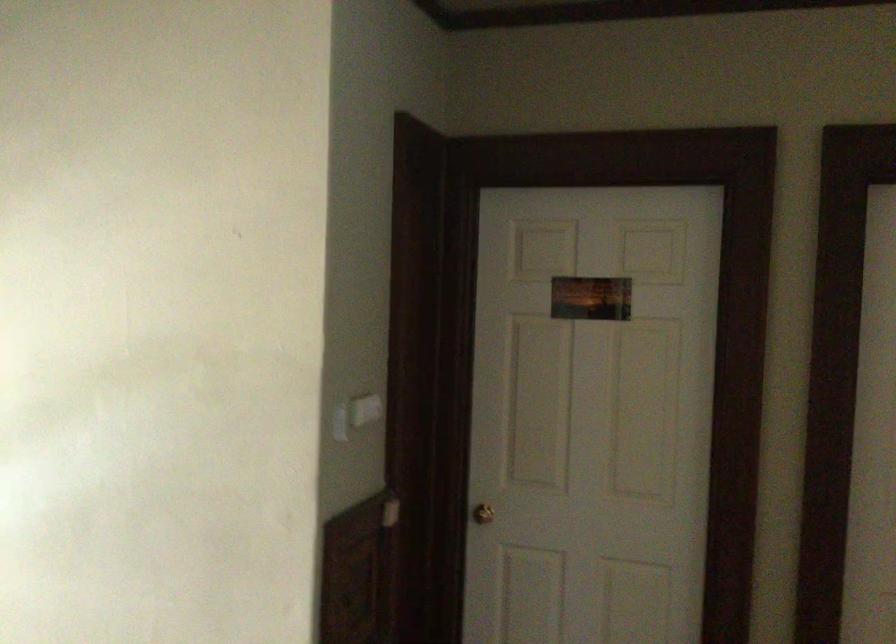
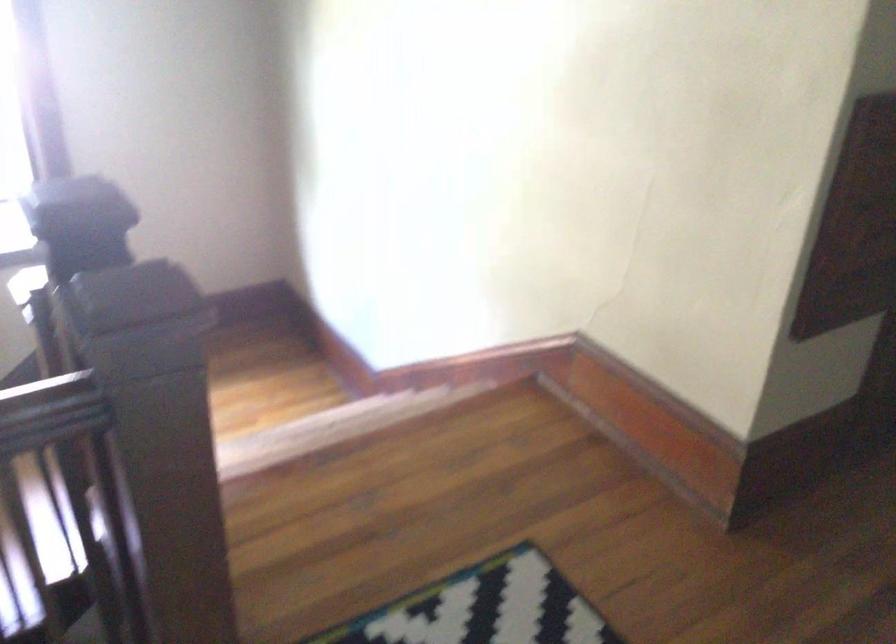
From the picture: The images are taken continuously from a first-person perspective. In which direction is your viewpoint rotating?

The rotation direction of the camera is left-down.